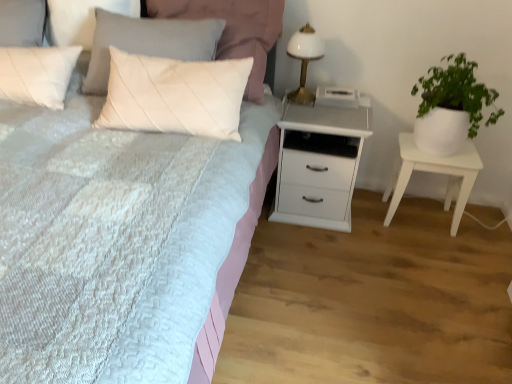
Question: Does white wood chest of drawers at center appear on the left side of white matte nightstand at right?

Choices:
 (A) no
 (B) yes

Answer: (B)

Question: Is white wood chest of drawers at center far from white matte nightstand at right?

Choices:
 (A) yes
 (B) no

Answer: (B)

Question: From the image's perspective, would you say white wood chest of drawers at center is positioned over white matte nightstand at right?

Choices:
 (A) no
 (B) yes

Answer: (B)

Question: Is white wood chest of drawers at center outside white matte nightstand at right?

Choices:
 (A) yes
 (B) no

Answer: (A)

Question: Does white wood chest of drawers at center turn towards white matte nightstand at right?

Choices:
 (A) yes
 (B) no

Answer: (B)

Question: Does white wood chest of drawers at center have a smaller size compared to white matte nightstand at right?

Choices:
 (A) yes
 (B) no

Answer: (B)

Question: Does white matte nightstand at right have a smaller size compared to white quilted pillow at upper center?

Choices:
 (A) no
 (B) yes

Answer: (B)

Question: Is white matte nightstand at right outside of white quilted pillow at upper center?

Choices:
 (A) yes
 (B) no

Answer: (A)

Question: Is white matte nightstand at right positioned with its back to white quilted pillow at upper center?

Choices:
 (A) no
 (B) yes

Answer: (A)

Question: From the image's perspective, is white matte nightstand at right located above white quilted pillow at upper center?

Choices:
 (A) no
 (B) yes

Answer: (A)

Question: From the image's perspective, would you say white matte nightstand at right is shown under white quilted pillow at upper center?

Choices:
 (A) yes
 (B) no

Answer: (A)

Question: Could you tell me if white matte nightstand at right is turned towards white quilted pillow at upper center?

Choices:
 (A) no
 (B) yes

Answer: (A)

Question: Is white textured bed at center facing towards green leafy plant in white pot at right?

Choices:
 (A) no
 (B) yes

Answer: (A)